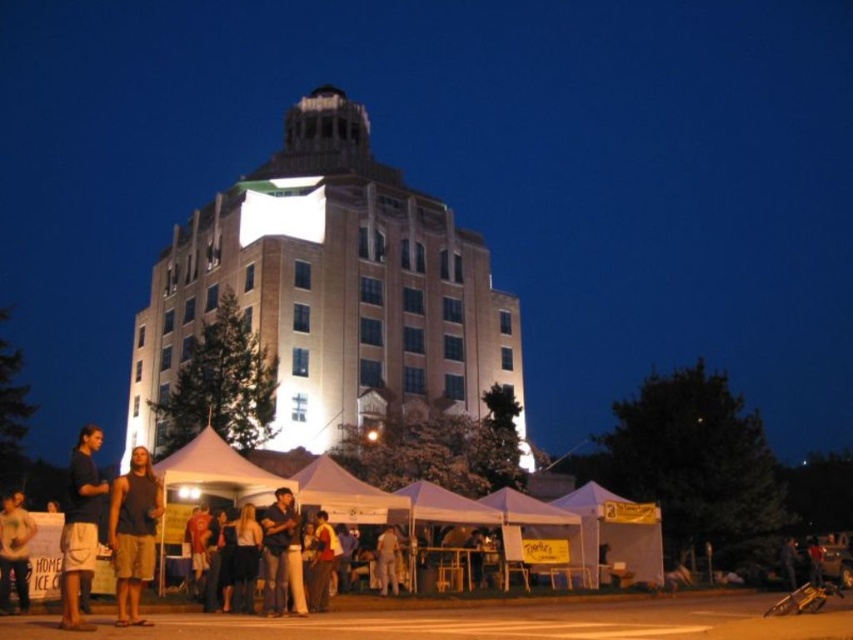
Question: Can you confirm if white brick building at center is thinner than light brown leather jacket at center?

Choices:
 (A) yes
 (B) no

Answer: (B)

Question: Is white brick building at center below light brown leather jacket at lower left?

Choices:
 (A) yes
 (B) no

Answer: (B)

Question: Which object is the farthest from the light brown leather jacket at lower left?

Choices:
 (A) dark blue t-shirt at left
 (B) dark blue shirt at center

Answer: (B)

Question: Which point is farther to the camera?

Choices:
 (A) (4, 500)
 (B) (380, 592)
 (C) (62, 609)
 (D) (277, 596)

Answer: (B)

Question: Is the position of dark blue shirt at center less distant than that of light brown leather jacket at center?

Choices:
 (A) yes
 (B) no

Answer: (A)

Question: Which point appears closest to the camera in this image?

Choices:
 (A) (314, 522)
 (B) (392, 566)
 (C) (381, 164)

Answer: (A)